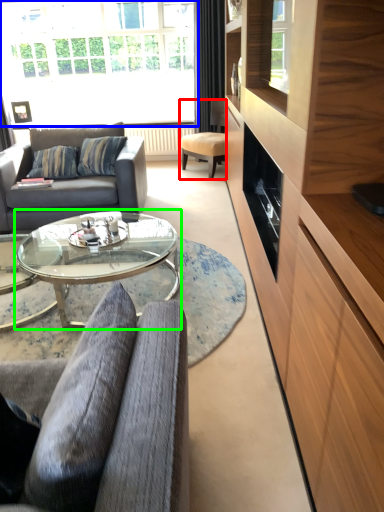
Question: Which object is positioned closest to chair (highlighted by a red box)? Select from window (highlighted by a blue box) and coffee table (highlighted by a green box).

Choices:
 (A) window
 (B) coffee table

Answer: (A)